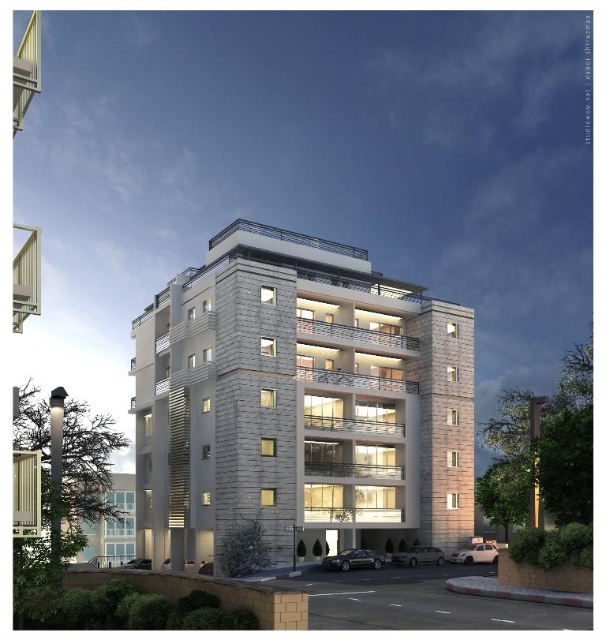
Question: Which object is closer to the camera taking this photo?

Choices:
 (A) white stone building at lower left
 (B) white stone building at center

Answer: (A)

Question: Which object is closer to the camera taking this photo?

Choices:
 (A) white stone building at center
 (B) white stone building at lower left

Answer: (B)

Question: Is the position of white stone building at center less distant than that of white stone building at lower left?

Choices:
 (A) yes
 (B) no

Answer: (B)

Question: Is white stone building at center above white stone building at lower left?

Choices:
 (A) yes
 (B) no

Answer: (A)

Question: Can you confirm if white stone building at center is wider than white stone building at lower left?

Choices:
 (A) yes
 (B) no

Answer: (A)

Question: Among these points, which one is farthest from the camera?

Choices:
 (A) (338, 493)
 (B) (133, 516)

Answer: (B)